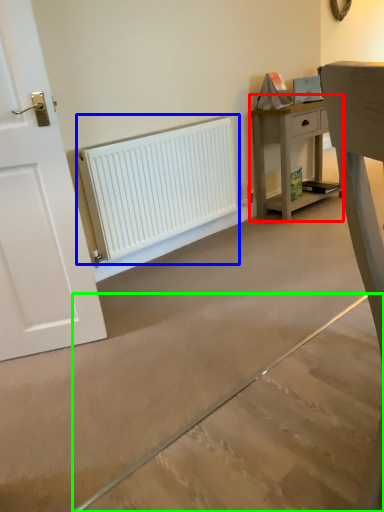
Question: Which is nearer to the nightstand (highlighted by a red box)? radiator (highlighted by a blue box) or concrete (highlighted by a green box).

Choices:
 (A) radiator
 (B) concrete

Answer: (A)